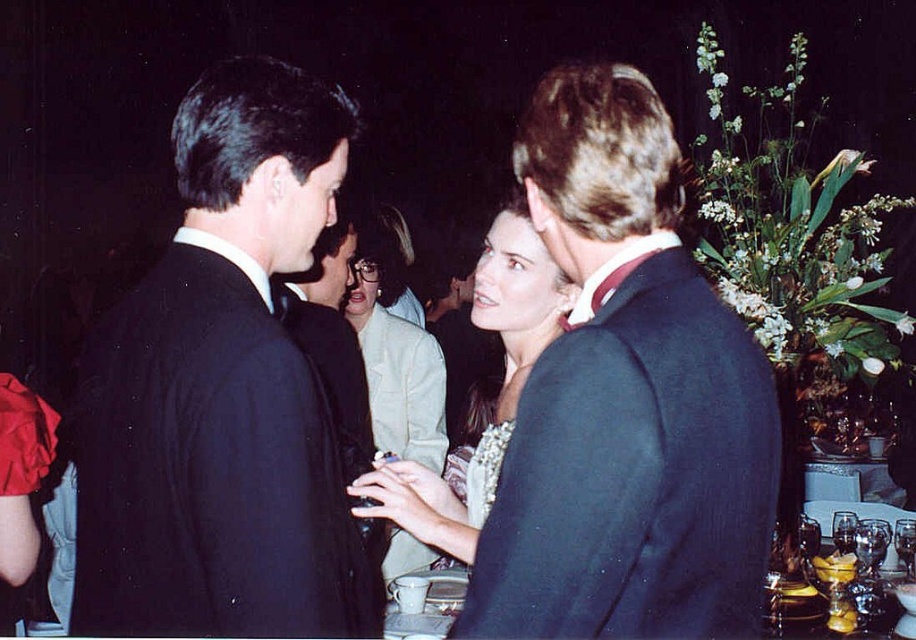
Question: Which point appears farthest from the camera in this image?

Choices:
 (A) (135, 336)
 (B) (663, 612)

Answer: (A)

Question: Which of these objects is positioned closest to the dark blue wool suit at center?

Choices:
 (A) shiny silver necklace at center
 (B) matte black suit at left

Answer: (A)

Question: Is matte black suit at left in front of shiny silver necklace at center?

Choices:
 (A) no
 (B) yes

Answer: (A)

Question: Does matte black suit at left have a lesser width compared to shiny silver necklace at center?

Choices:
 (A) yes
 (B) no

Answer: (B)

Question: Which point is closer to the camera taking this photo?

Choices:
 (A) (511, 225)
 (B) (259, 285)

Answer: (B)

Question: Can you confirm if matte black suit at left is positioned above shiny silver necklace at center?

Choices:
 (A) no
 (B) yes

Answer: (B)